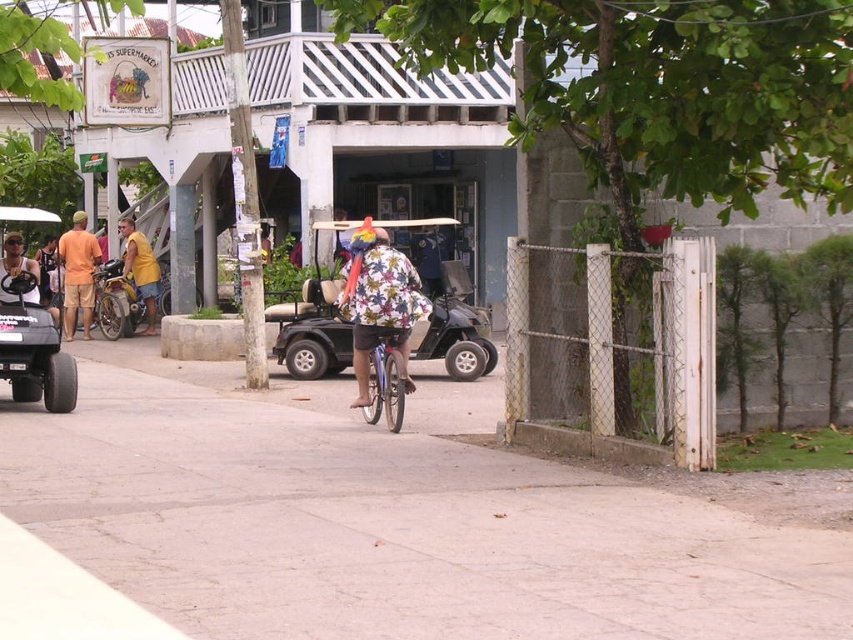
You are a tourist in this tropical area and want to take a photo of the metallic gray golf cart at center without the matte orange shirt at left appearing in the frame. Which direction should you move to achieve this?

The metallic gray golf cart at center is positioned under the matte orange shirt at left. To avoid the matte orange shirt at left in your photo, move to the right side of the metallic gray golf cart at center.

In the scene shown: You are a delivery person who needs to choose a golf cart for transporting heavy packages. The metallic gray golf cart at center and the matte black golf cart at left are available. Which golf cart has a larger size to accommodate your packages?

The matte black golf cart at left is larger than the metallic gray golf cart at center, so it can accommodate the heavy packages better.